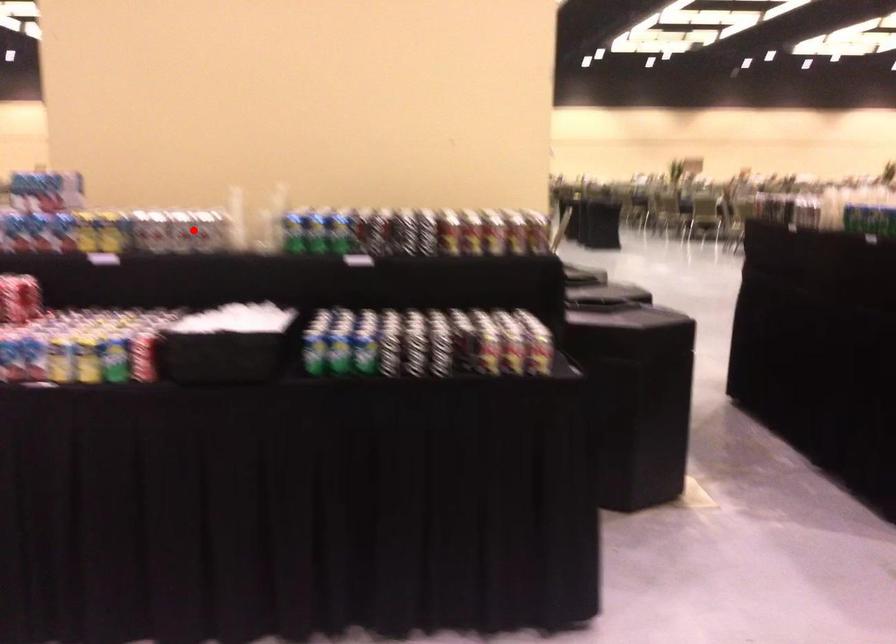
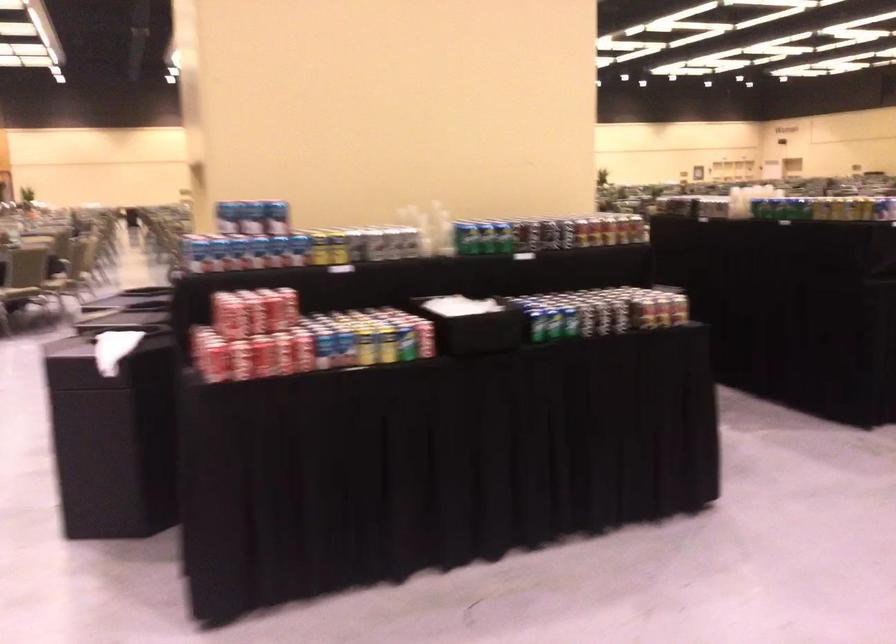
Question: I am providing you with two images of the same scene from different viewpoints. Given a red point in image1, look at the same physical point in image2. Is it:

Choices:
 (A) Closer to the viewpoint
 (B) Farther from the viewpoint

Answer: (B)